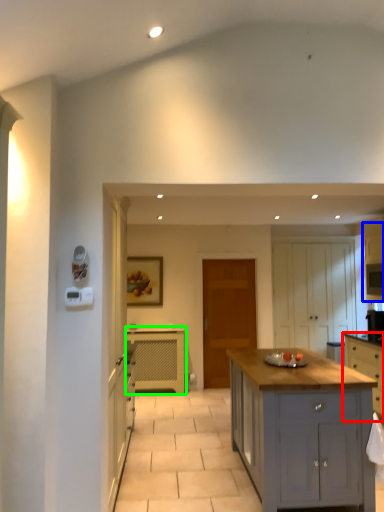
Question: Which object is positioned closest to cabinetry (highlighted by a red box)? Select from cabinetry (highlighted by a blue box) and cabinetry (highlighted by a green box).

Choices:
 (A) cabinetry
 (B) cabinetry

Answer: (A)